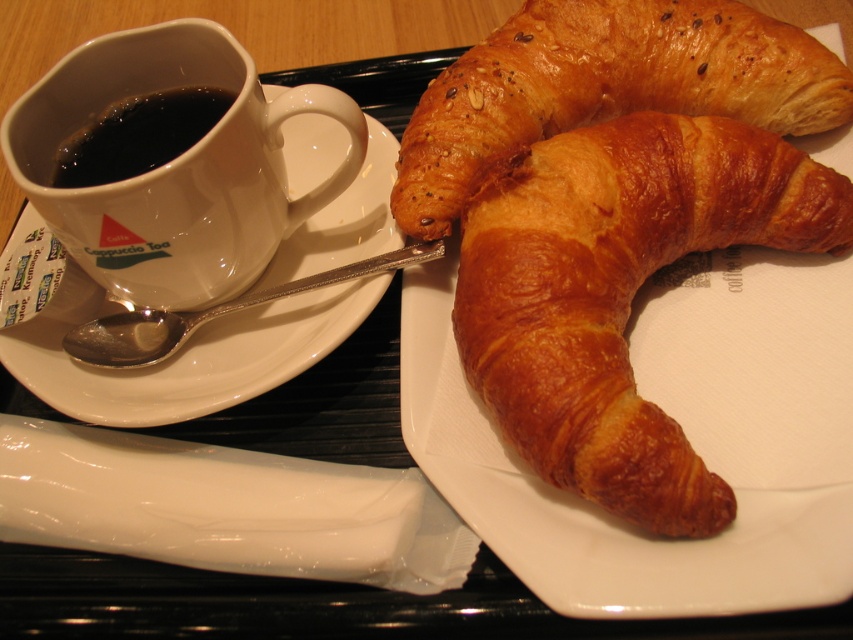
Who is higher up, golden brown flaky croissant at upper right or black matte cup at upper left?

golden brown flaky croissant at upper right

Does golden brown flaky croissant at upper right appear over black matte cup at upper left?

Yes, golden brown flaky croissant at upper right is above black matte cup at upper left.

Between point (637, 108) and point (96, 173), which one is positioned behind?

Point (637, 108)

I want to click on golden brown flaky croissant at upper right, so click(604, 88).

Consider the image. Which is above, golden brown flaky croissant at center or golden brown flaky croissant at upper right?

golden brown flaky croissant at upper right

Is point (637, 467) positioned behind point (519, 84)?

That is False.

Identify the location of golden brown flaky croissant at center. The height and width of the screenshot is (640, 853). tap(618, 292).

Between golden brown flaky croissant at center and white ceramic saucer at left, which one is positioned lower?

golden brown flaky croissant at center is lower down.

Does golden brown flaky croissant at center have a greater height compared to white ceramic saucer at left?

In fact, golden brown flaky croissant at center may be shorter than white ceramic saucer at left.

Is point (653, 506) behind point (260, 324)?

No, (653, 506) is in front of (260, 324).

In order to click on golden brown flaky croissant at center in this screenshot , I will do `click(618, 292)`.